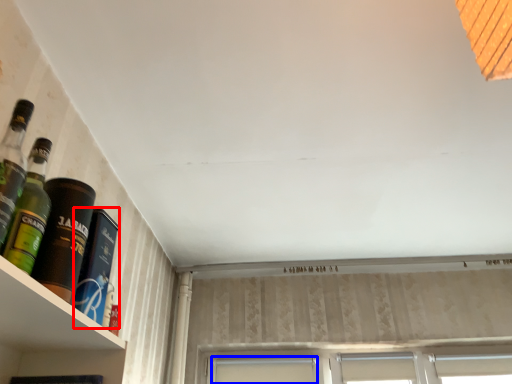
Question: Among these objects, which one is farthest to the camera, bottle (highlighted by a red box) or window (highlighted by a blue box)?

Choices:
 (A) bottle
 (B) window

Answer: (B)